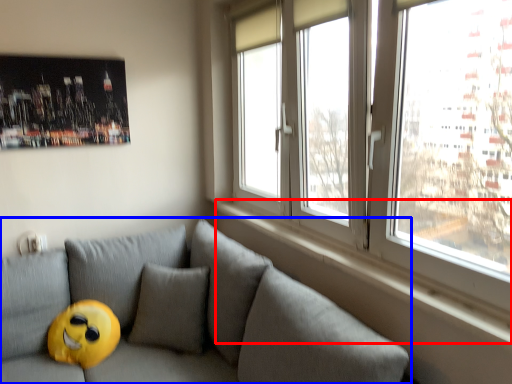
Question: Which of the following is the closest to the observer, window sill (highlighted by a red box) or studio couch (highlighted by a blue box)?

Choices:
 (A) window sill
 (B) studio couch

Answer: (B)